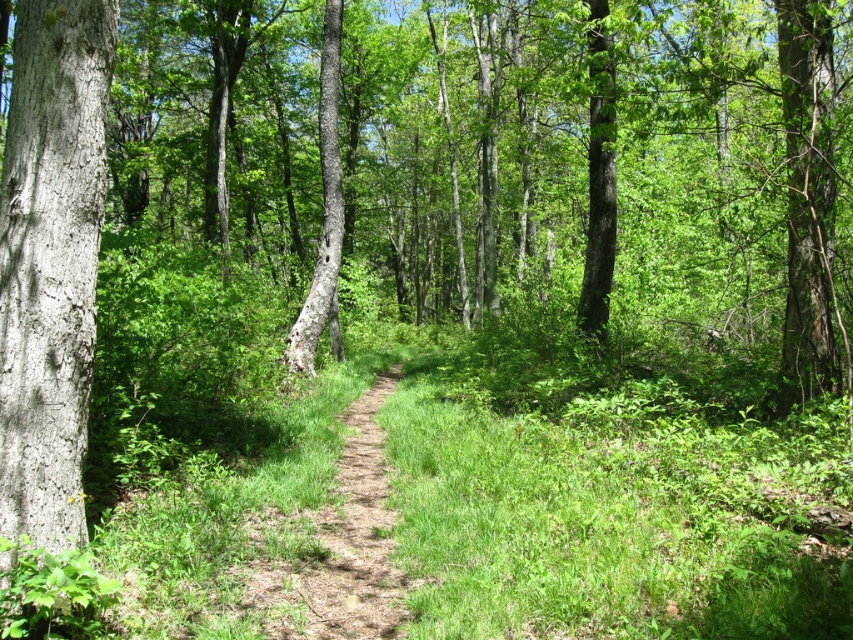
Question: Does brown dirt path at center have a smaller size compared to smooth bark tree at center?

Choices:
 (A) yes
 (B) no

Answer: (A)

Question: Which object is farther from the camera taking this photo?

Choices:
 (A) smooth gray bark at left
 (B) brown dirt path at center

Answer: (B)

Question: Which point appears closest to the camera in this image?

Choices:
 (A) (325, 204)
 (B) (384, 550)

Answer: (B)

Question: In this image, where is brown dirt path at center located relative to smooth bark tree at center?

Choices:
 (A) right
 (B) left

Answer: (A)

Question: Is brown dirt path at center positioned before smooth bark tree at center?

Choices:
 (A) no
 (B) yes

Answer: (B)

Question: Which point is farther to the camera?

Choices:
 (A) (361, 451)
 (B) (97, 38)

Answer: (A)